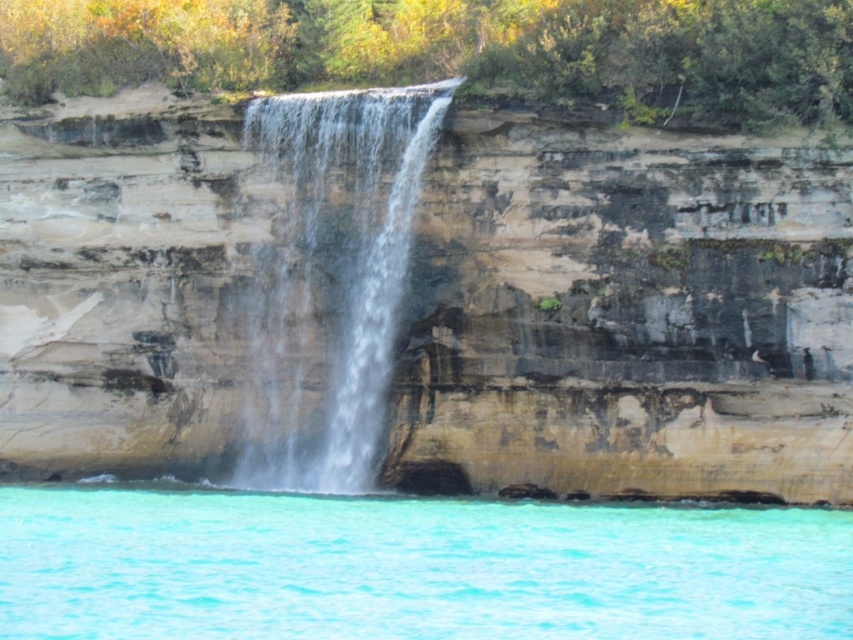
Who is positioned more to the left, turquoise liquid at lower center or clear water at center?

clear water at center is more to the left.

Is turquoise liquid at lower center positioned before clear water at center?

Yes, it is.

Does point (222, 627) lie in front of point (355, 186)?

Yes, point (222, 627) is closer to viewer.

You are a GUI agent. You are given a task and a screenshot of the screen. Output one action in this format:
    pyautogui.click(x=<x>, y=<y>)
    Task: Click on the turquoise liquid at lower center
    The height and width of the screenshot is (640, 853).
    Given the screenshot: What is the action you would take?
    pyautogui.click(x=410, y=566)

Which of these two, brown/rocky cliff face at center or turquoise liquid at lower center, stands shorter?

Standing shorter between the two is turquoise liquid at lower center.

Is brown/rocky cliff face at center to the left of turquoise liquid at lower center from the viewer's perspective?

Incorrect, brown/rocky cliff face at center is not on the left side of turquoise liquid at lower center.

Is point (209, 429) closer to camera compared to point (815, 595)?

No, it is behind (815, 595).

Find the location of a particular element. The height and width of the screenshot is (640, 853). brown/rocky cliff face at center is located at coordinates (426, 301).

Which is in front, point (599, 182) or point (314, 211)?

Point (599, 182) is more forward.

Can you confirm if brown/rocky cliff face at center is smaller than clear water at center?

No, brown/rocky cliff face at center is not smaller than clear water at center.

Which is behind, point (247, 342) or point (271, 317)?

The point (247, 342) is more distant.

Locate an element on the screen. The width and height of the screenshot is (853, 640). brown/rocky cliff face at center is located at coordinates (426, 301).